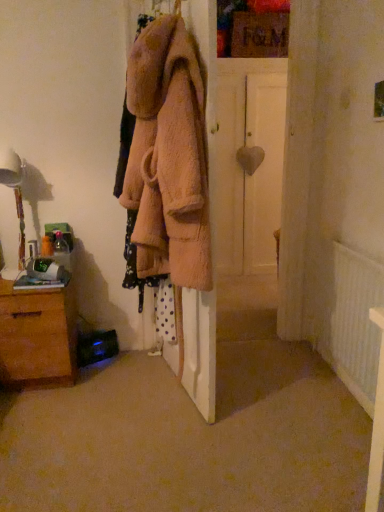
The width and height of the screenshot is (384, 512). I want to click on free spot in front of brown wooden chest of drawers at lower left, so click(x=46, y=417).